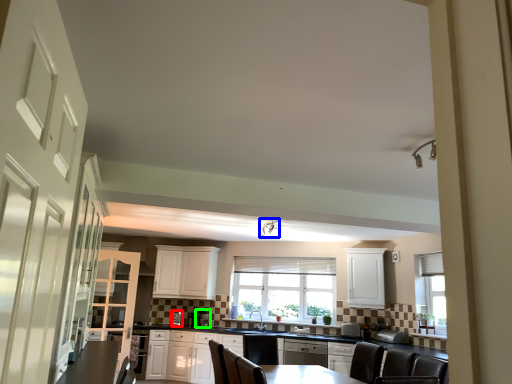
Question: Based on their relative distances, which object is nearer to appliance (highlighted by a red box)? Choose from light fixture (highlighted by a blue box) and appliance (highlighted by a green box).

Choices:
 (A) light fixture
 (B) appliance

Answer: (B)